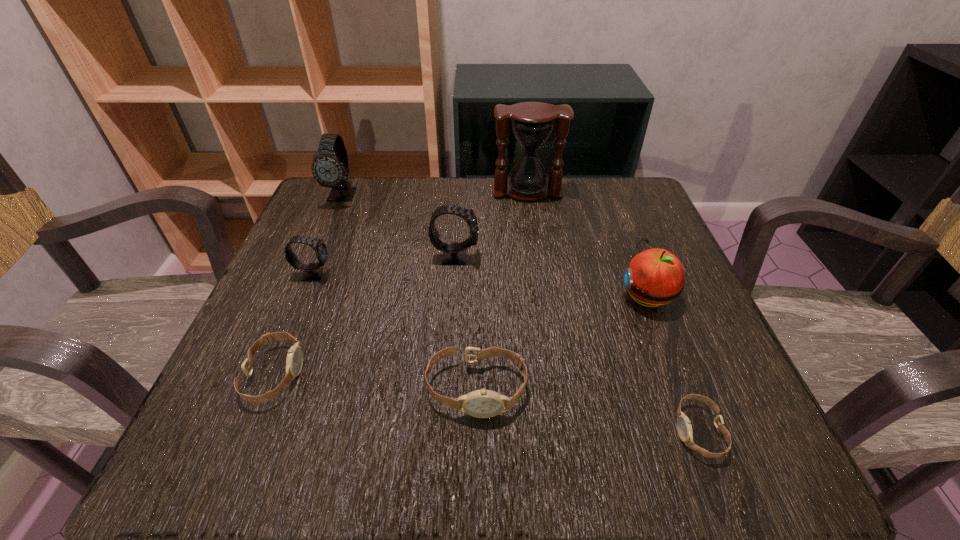
The height and width of the screenshot is (540, 960). Find the location of `the fourth tallest watch`. the fourth tallest watch is located at coordinates (483, 403).

You are a GUI agent. You are given a task and a screenshot of the screen. Output one action in this format:
    pyautogui.click(x=<x>, y=<y>)
    Task: Click on the second biggest beige watch
    
    Given the screenshot: What is the action you would take?
    pyautogui.click(x=294, y=361)

Image resolution: width=960 pixels, height=540 pixels. In order to click on the leftmost beige watch in this screenshot , I will do `click(294, 361)`.

Locate an element on the screen. The width and height of the screenshot is (960, 540). the shortest watch is located at coordinates (684, 427).

The image size is (960, 540). What are the coordinates of `the shortest object` in the screenshot? It's located at (x=684, y=427).

Locate an element on the screen. Image resolution: width=960 pixels, height=540 pixels. vacant space situated 0.070m on the right of the brown hourglass is located at coordinates (590, 192).

At what (x,y) coordinates should I click in order to perform the action: click on free space located 0.340m on the face of the seventh shortest object. Please return your answer as a coordinate pair (x, y). The width and height of the screenshot is (960, 540). Looking at the image, I should click on (292, 319).

Find the location of a particular element. The height and width of the screenshot is (540, 960). vacant space positioned on the face of the second smallest gray watch is located at coordinates (513, 256).

Where is `vacant position located on the front of the apple`? vacant position located on the front of the apple is located at coordinates tap(684, 391).

Locate an element on the screen. The width and height of the screenshot is (960, 540). vacant region located 0.400m on the face of the fifth tallest object is located at coordinates (536, 274).